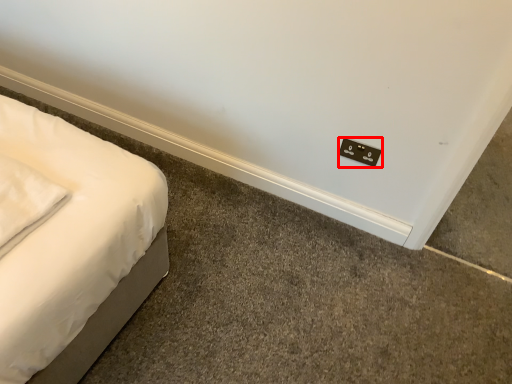
Question: Where is electric outlet (annotated by the red box) located in relation to pillow in the image?

Choices:
 (A) right
 (B) left

Answer: (A)